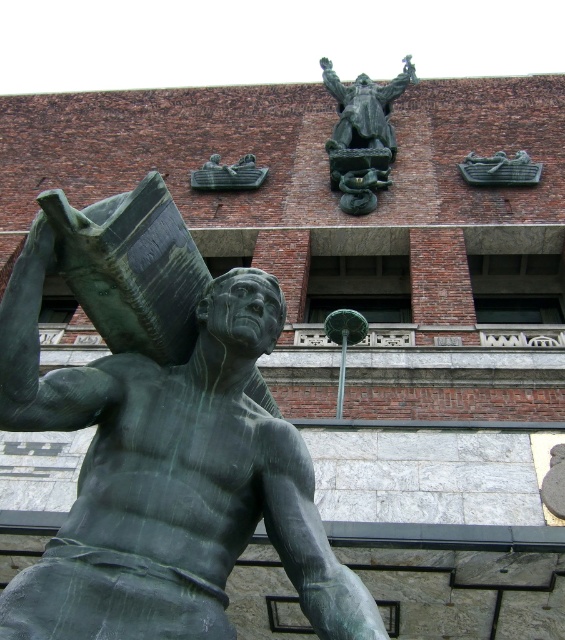
Question: Is green patina bronze statue at center positioned in front of green patina book at upper center?

Choices:
 (A) no
 (B) yes

Answer: (B)

Question: Does green patina bronze statue at center lie behind green patina book at upper center?

Choices:
 (A) yes
 (B) no

Answer: (B)

Question: Which of the following is the farthest from the observer?

Choices:
 (A) green patina book at upper center
 (B) green patina bronze statue at center

Answer: (A)

Question: Among these points, which one is farthest from the camera?

Choices:
 (A) (371, 90)
 (B) (258, 172)
 (C) (138, 240)

Answer: (A)

Question: Estimate the real-world distances between objects in this image. Which object is farther from the bronze statue at upper center?

Choices:
 (A) green patina bronze statue at center
 (B) green patina book at upper center

Answer: (A)

Question: Is bronze statue at upper center positioned in front of green patina book at upper center?

Choices:
 (A) no
 (B) yes

Answer: (B)